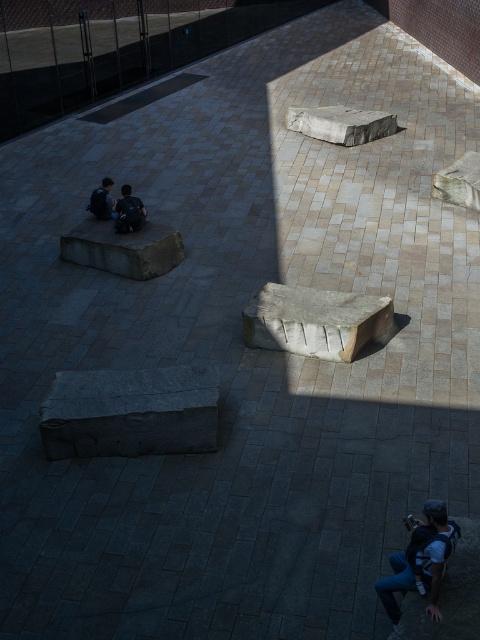
Question: Which object appears farthest from the camera in this image?

Choices:
 (A) dark blue jeans at left
 (B) denim jacket at lower right

Answer: (A)

Question: Based on their relative distances, which object is farther from the denim jacket at lower right?

Choices:
 (A) dark blue jeans at left
 (B) dark gray stone figure at center-left

Answer: (B)

Question: Is denim jacket at lower right above dark gray stone figure at center-left?

Choices:
 (A) yes
 (B) no

Answer: (B)

Question: Is denim jacket at lower right to the left of dark gray stone figure at center-left from the viewer's perspective?

Choices:
 (A) no
 (B) yes

Answer: (A)

Question: Which of the following is the farthest from the observer?

Choices:
 (A) dark gray stone figure at center-left
 (B) dark blue jeans at left
 (C) denim jacket at lower right

Answer: (A)

Question: Is dark blue jeans at left positioned before dark gray stone figure at center-left?

Choices:
 (A) no
 (B) yes

Answer: (B)